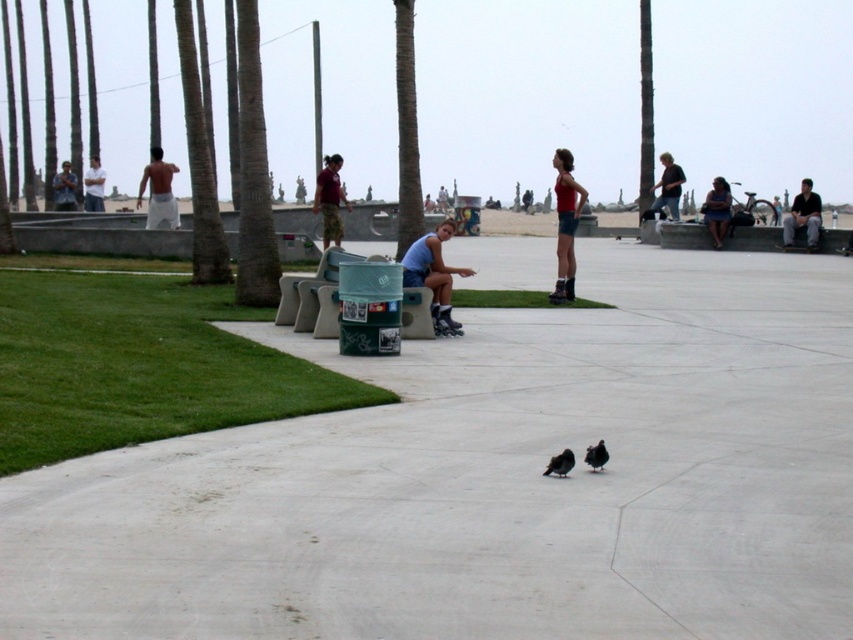
Question: Which object is positioned farthest from the camouflage shirt at left?

Choices:
 (A) dark gray shirt at right
 (B) blue fabric shirt at center

Answer: (B)

Question: Does maroon fabric shirt at upper center appear on the left side of dark blue jeans at center?

Choices:
 (A) yes
 (B) no

Answer: (A)

Question: Can you confirm if green textured palm tree at left is wider than matte red tank top at center?

Choices:
 (A) yes
 (B) no

Answer: (A)

Question: Which object is closer to the camera taking this photo?

Choices:
 (A) green leafy palm tree at left
 (B) shiny white shorts at left

Answer: (A)

Question: Which point appears closest to the camera in this image?

Choices:
 (A) pos(438,308)
 (B) pos(170,189)
 (C) pos(556,461)

Answer: (C)

Question: Is dark gray shirt at right below black matte pigeon at center?

Choices:
 (A) no
 (B) yes

Answer: (A)